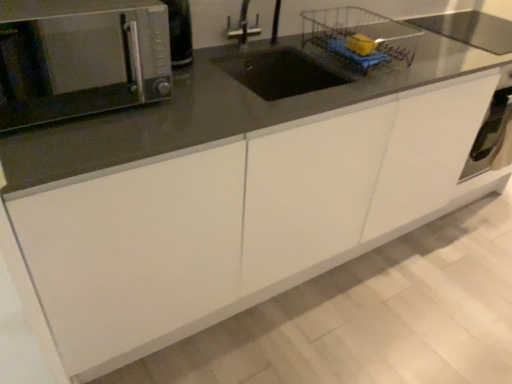
Question: In the image, is yellow sponge at upper right on the left side or the right side of satin silver oven at lower right?

Choices:
 (A) right
 (B) left

Answer: (B)

Question: From a real-world perspective, relative to satin silver oven at lower right, is yellow sponge at upper right vertically above or below?

Choices:
 (A) below
 (B) above

Answer: (B)

Question: Which object is the farthest from the yellow sponge at upper right?

Choices:
 (A) satin silver microwave at upper left
 (B) satin silver oven at lower right
 (C) wire mesh basket at upper center

Answer: (A)

Question: Estimate the real-world distances between objects in this image. Which object is closer to the wire mesh basket at upper center?

Choices:
 (A) satin silver microwave at upper left
 (B) yellow sponge at upper right
 (C) satin silver oven at lower right

Answer: (B)